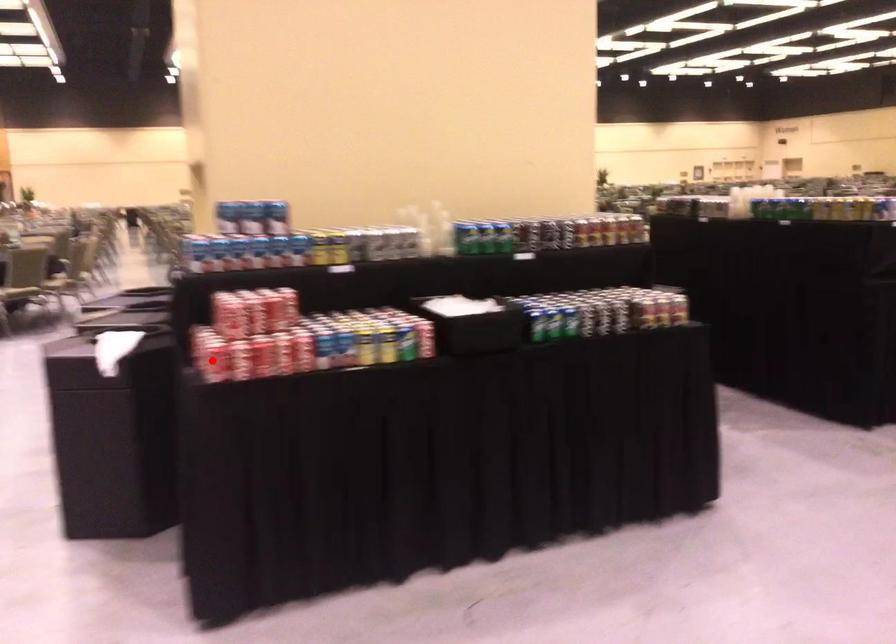
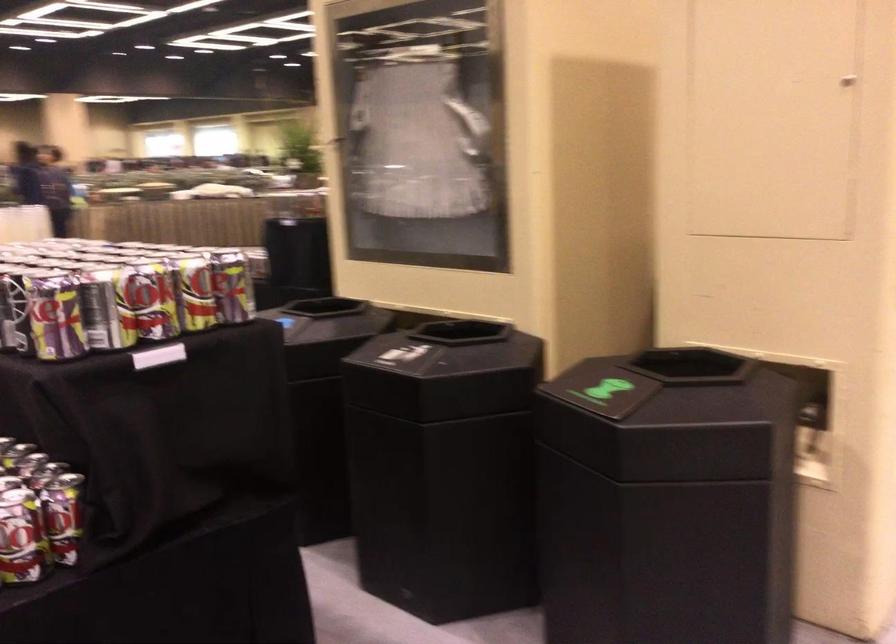
Question: I am providing you with two images of the same scene from different viewpoints. A red point is marked on the first image. At the location where the point appears in image 1, is it still visible in image 2?

Choices:
 (A) Yes
 (B) No

Answer: (B)